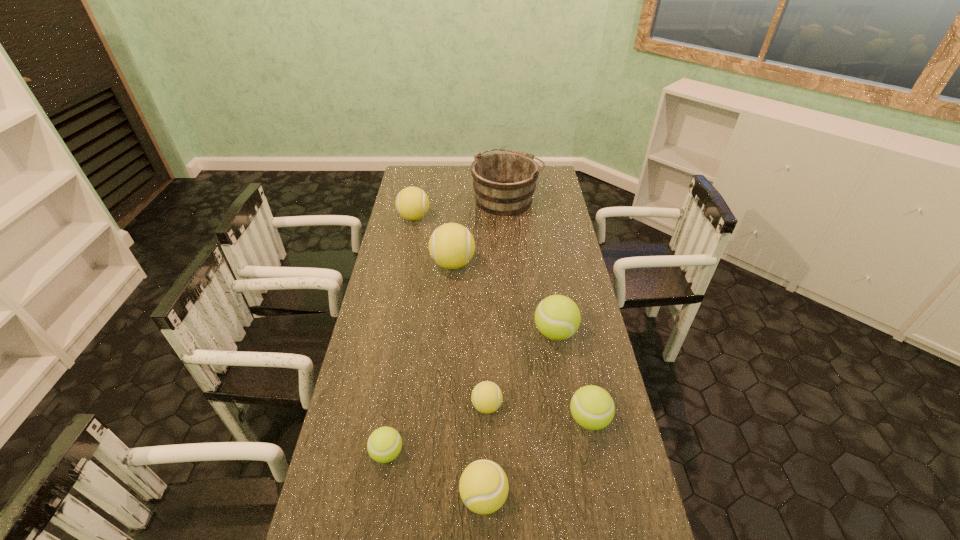
I want to click on green tennis ball identified as the closest to the wine bucket, so click(557, 317).

Identify which green tennis ball is the second closest to the third smallest yellow tennis ball. Please provide its 2D coordinates. Your answer should be formatted as a tuple, i.e. [(x, y)], where the tuple contains the x and y coordinates of a point satisfying the conditions above.

[(384, 444)]

Identify the location of free location that satisfies the following two spatial constraints: 1. on the back side of the smallest green tennis ball; 2. on the left side of the sixth nearest tennis ball. (418, 264).

Image resolution: width=960 pixels, height=540 pixels. In order to click on vacant position in the image that satisfies the following two spatial constraints: 1. on the front side of the nearest object; 2. on the right side of the farthest tennis ball in this screenshot , I will do `click(360, 497)`.